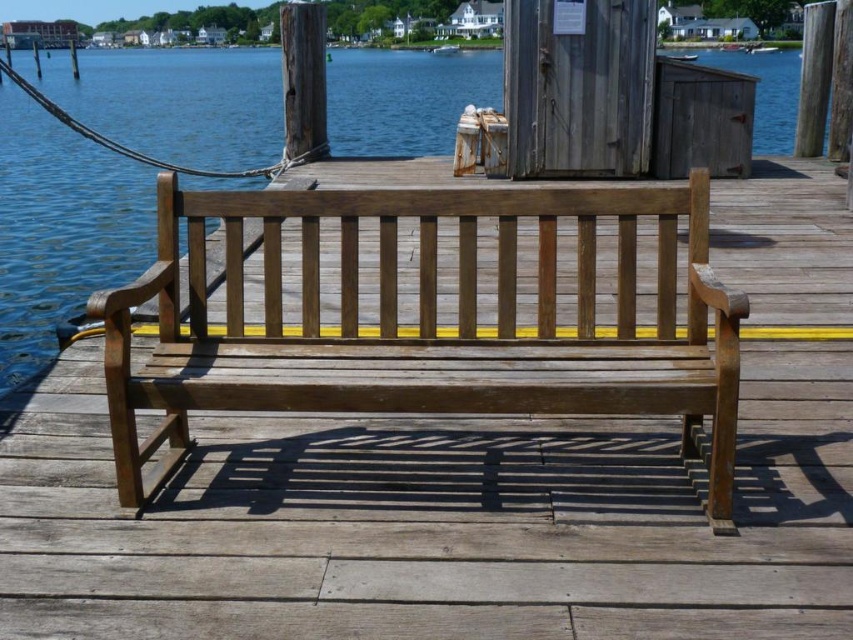
You are designing a safety plan for the dock and need to ensure that the matte wood bench at center and the transparent blue water at center are appropriately spaced. Based on their widths, which object is narrower and requires more caution when placing safety markers?

The matte wood bench at center is narrower than the transparent blue water at center, so it requires more caution when placing safety markers to ensure proper spacing.

You are standing on the wooden dock and want to sit down on the matte wood bench at center. Considering the height difference between the bench and the transparent blue water at center, will your feet touch the water when you sit?

The matte wood bench at center has a lesser height compared to transparent blue water at center, so when you sit on the bench, your feet will be lower than the water level. However, since the bench is on the dock and the water is at the same level, your feet will not actually touch the water unless you lean forward or the dock is submerged, which isn

You are an artist planning to paint the scene. You want to ensure the matte wood bench at center is proportionally accurate compared to the transparent blue water at center. Based on the scene, which object should you make larger in your painting?

The transparent blue water at center should be made larger in the painting since the matte wood bench at center is smaller than the transparent blue water at center according to the description.